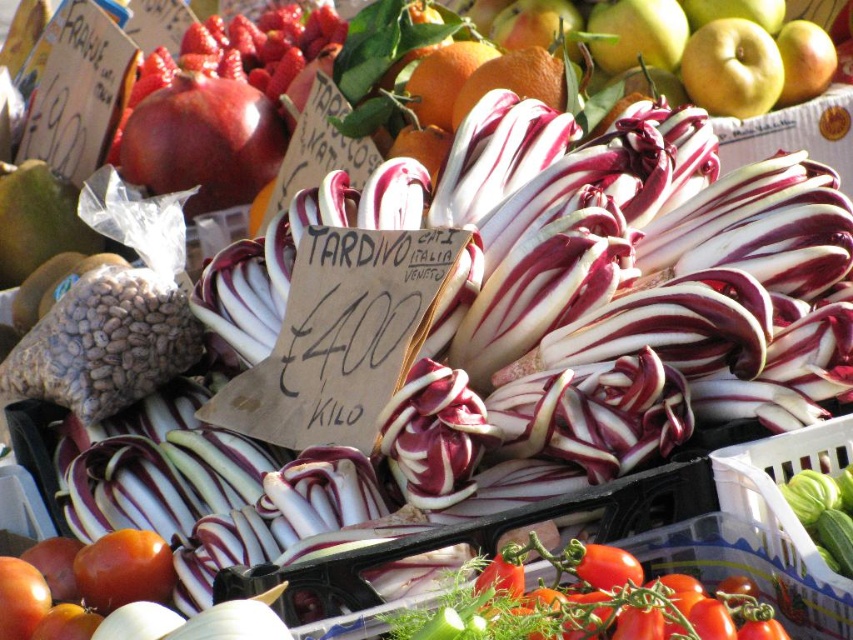
Question: Does shiny red tomato at lower left have a larger size compared to green matte apple at upper center?

Choices:
 (A) yes
 (B) no

Answer: (B)

Question: Based on their relative distances, which object is farther from the shiny red tomato at lower left?

Choices:
 (A) glossy red tomato at lower left
 (B) green matte apple at upper center
 (C) smooth green apple at upper right
 (D) green matte apple at upper right

Answer: (C)

Question: Does green matte apple at upper right appear under green matte apple at upper center?

Choices:
 (A) yes
 (B) no

Answer: (A)

Question: Which object is farther from the camera taking this photo?

Choices:
 (A) glossy red tomato at lower left
 (B) smooth green apple at upper right

Answer: (B)

Question: Does shiny red pomegranate at upper left have a greater width compared to green matte apple at upper right?

Choices:
 (A) no
 (B) yes

Answer: (B)

Question: Estimate the real-world distances between objects in this image. Which object is farther from the shiny red pomegranate at upper left?

Choices:
 (A) green matte apple at upper right
 (B) smooth green apple at upper right
 (C) shiny red tomato at lower left
 (D) green matte apple at upper center

Answer: (C)